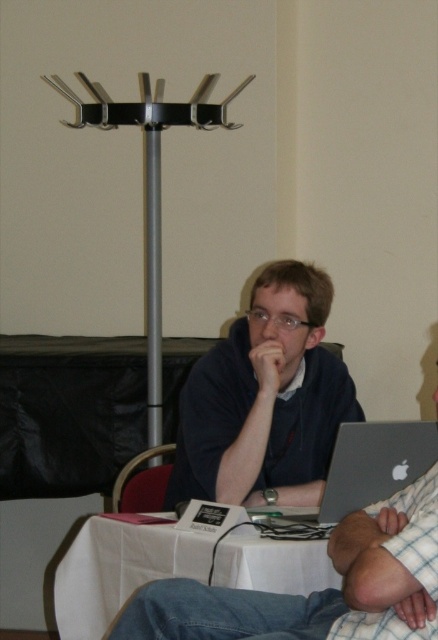
Is white cloth table at center taller than silver metallic laptop at center?

Indeed, white cloth table at center has a greater height compared to silver metallic laptop at center.

Between point (269, 586) and point (355, 458), which one is positioned in front?

Point (269, 586) is in front.

Image resolution: width=438 pixels, height=640 pixels. I want to click on white cloth table at center, so point(120,570).

Between matte black shirt at center and white cloth table at center, which one has more height?

matte black shirt at center is taller.

Can you confirm if matte black shirt at center is positioned to the left of white cloth table at center?

No, matte black shirt at center is not to the left of white cloth table at center.

Describe the element at coordinates (264, 400) in the screenshot. I see `matte black shirt at center` at that location.

I want to click on matte black shirt at center, so click(x=264, y=400).

Between matte black laptop at center and red fabric chair at lower left, which one has more height?

matte black laptop at center is taller.

Does point (368, 561) come closer to viewer compared to point (156, 484)?

Yes, it is in front of point (156, 484).

Does point (317, 634) come behind point (156, 504)?

No, it is in front of (156, 504).

Image resolution: width=438 pixels, height=640 pixels. I want to click on matte black laptop at center, so click(x=317, y=592).